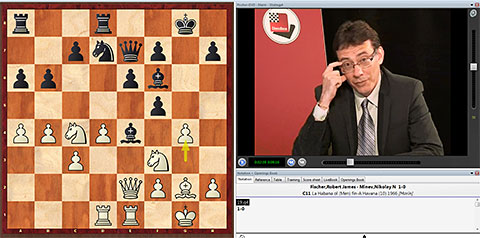
I want to click on screen computer, so click(437, 48).